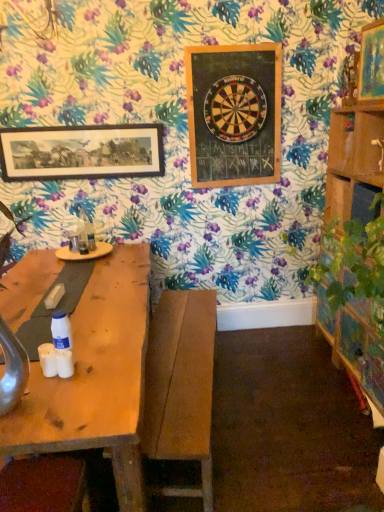
Question: Is wooden framed print at upper left, which is the third picture frame from right to left, looking in the opposite direction of wooden bench at center, placed as the first swivel chair when sorted from back to front?

Choices:
 (A) no
 (B) yes

Answer: (A)

Question: Is wooden framed print at upper left, the 3th picture frame when ordered from front to back, directly adjacent to wooden bench at center, the second swivel chair from the left?

Choices:
 (A) yes
 (B) no

Answer: (B)

Question: From the image's perspective, is wooden framed print at upper left, which is the third picture frame from right to left, located beneath wooden bench at center, placed as the first swivel chair when sorted from back to front?

Choices:
 (A) no
 (B) yes

Answer: (A)

Question: Does wooden framed print at upper left, the 3th picture frame when ordered from front to back, contain wooden bench at center, placed as the first swivel chair when sorted from back to front?

Choices:
 (A) no
 (B) yes

Answer: (A)

Question: Does wooden framed print at upper left, the 1th picture frame when ordered from left to right, appear on the left side of wooden bench at center, placed as the first swivel chair when sorted from back to front?

Choices:
 (A) yes
 (B) no

Answer: (A)

Question: Considering the positions of point (377, 44) and point (215, 56), is point (377, 44) closer or farther from the camera than point (215, 56)?

Choices:
 (A) farther
 (B) closer

Answer: (B)

Question: Considering their positions, is wooden picture frame at upper right, arranged as the 1th picture frame when viewed from the right, located in front of or behind wooden dartboard at upper center, positioned as the second picture frame in back-to-front order?

Choices:
 (A) behind
 (B) front

Answer: (B)

Question: Considering the positions of wooden picture frame at upper right, the 3th picture frame when ordered from back to front, and wooden dartboard at upper center, positioned as the second picture frame in back-to-front order, in the image, is wooden picture frame at upper right, the 3th picture frame when ordered from back to front, wider or thinner than wooden dartboard at upper center, positioned as the second picture frame in back-to-front order,?

Choices:
 (A) wide
 (B) thin

Answer: (A)

Question: Is wooden picture frame at upper right, positioned as the first picture frame in front-to-back order, situated inside wooden dartboard at upper center, the second picture frame in the front-to-back sequence, or outside?

Choices:
 (A) inside
 (B) outside

Answer: (B)

Question: Is wooden dartboard at upper center, the 2th picture frame when ordered from right to left, taller or shorter than wooden bench at center, placed as the first swivel chair when sorted from back to front?

Choices:
 (A) tall
 (B) short

Answer: (A)

Question: From a real-world perspective, is wooden dartboard at upper center, positioned as the second picture frame in back-to-front order, positioned above or below wooden bench at center, the second swivel chair from the left?

Choices:
 (A) above
 (B) below

Answer: (A)

Question: Does point (203, 145) appear closer or farther from the camera than point (188, 439)?

Choices:
 (A) farther
 (B) closer

Answer: (A)

Question: Is wooden dartboard at upper center, which is the second picture frame in left-to-right order, to the left or to the right of wooden bench at center, which is the 2th swivel chair in front-to-back order, in the image?

Choices:
 (A) right
 (B) left

Answer: (A)

Question: Is wooden dartboard at upper center, the 2th picture frame when ordered from right to left, to the left or to the right of wooden picture frame at upper right, the 3th picture frame when ordered from back to front, in the image?

Choices:
 (A) right
 (B) left

Answer: (B)

Question: From their relative heights in the image, would you say wooden dartboard at upper center, which is the second picture frame in left-to-right order, is taller or shorter than wooden picture frame at upper right, the 3th picture frame when ordered from back to front?

Choices:
 (A) tall
 (B) short

Answer: (A)